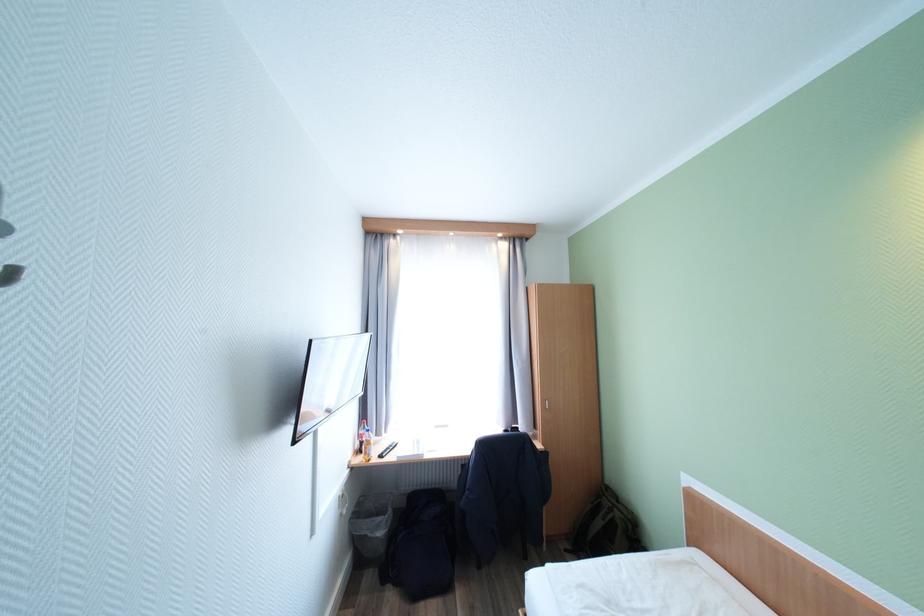
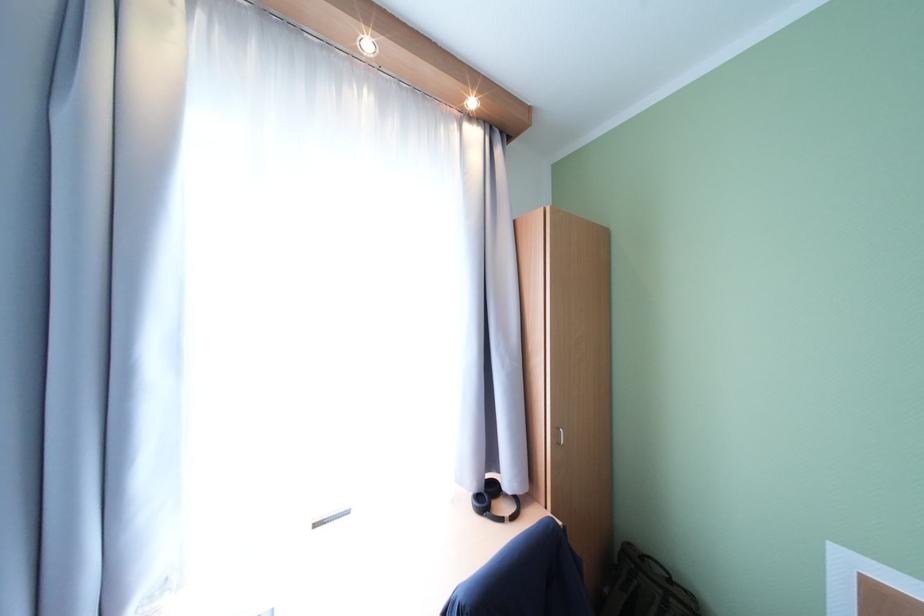
Locate, in the second image, the point that corresponds to point (513, 432) in the first image.

(484, 498)